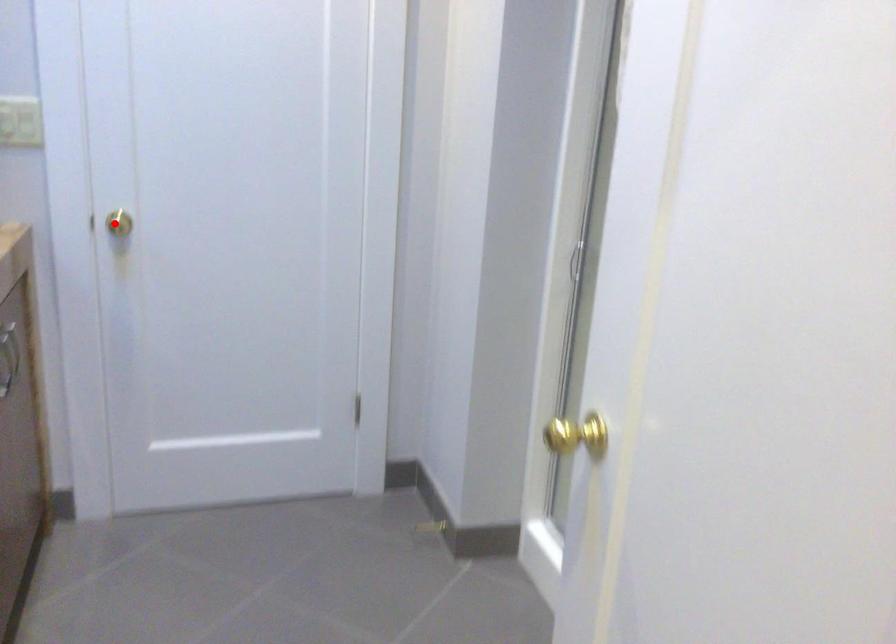
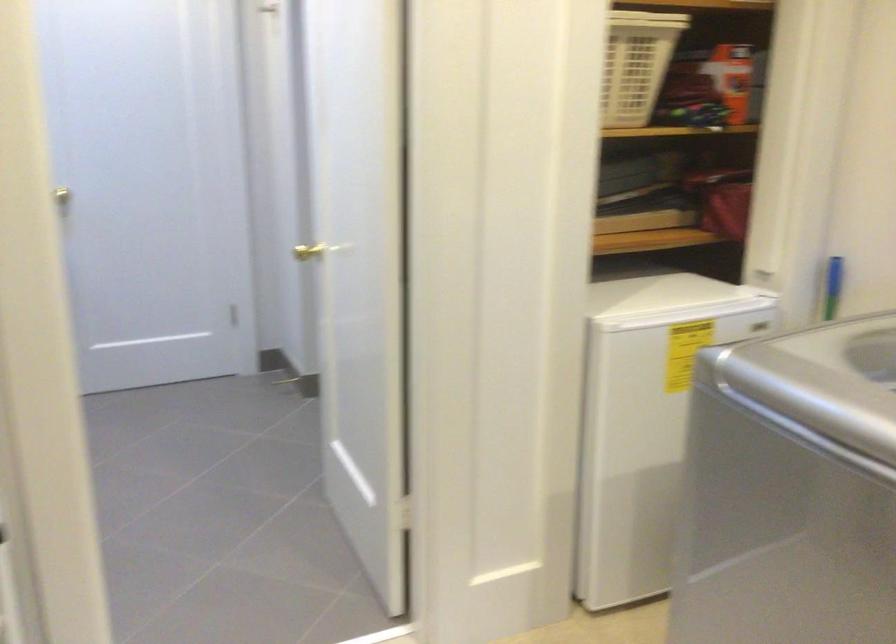
Question: I am providing you with two images of the same scene from different viewpoints. A red point is shown in image1. For the corresponding object point in image2, is it positioned nearer or farther from the camera?

Choices:
 (A) Nearer
 (B) Farther

Answer: (B)